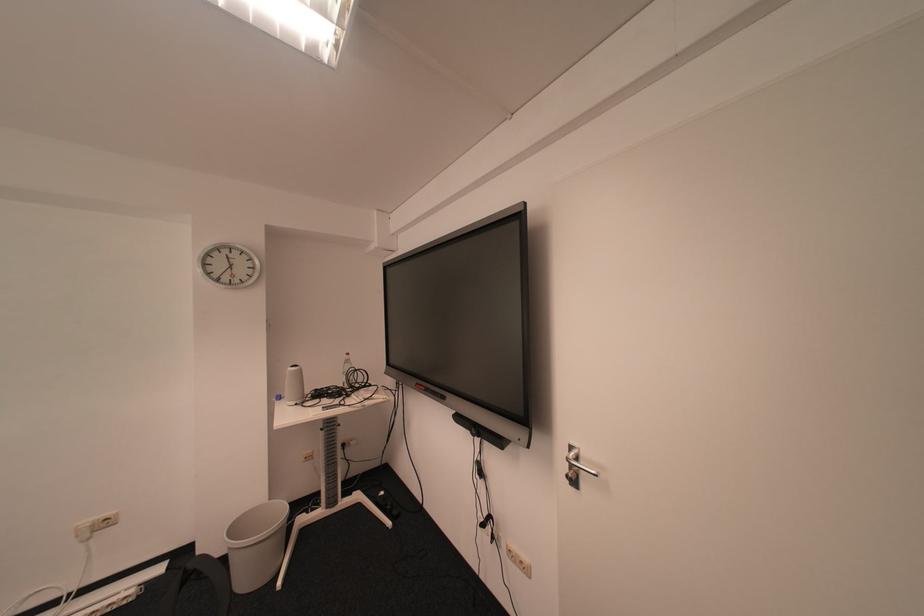
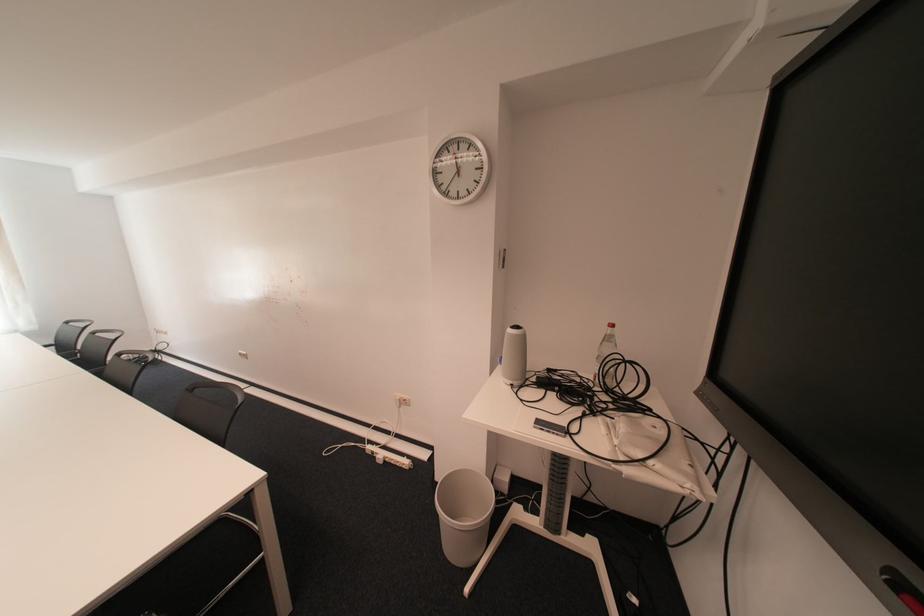
Locate, in the second image, the point that corresponds to (x=89, y=528) in the first image.

(407, 397)